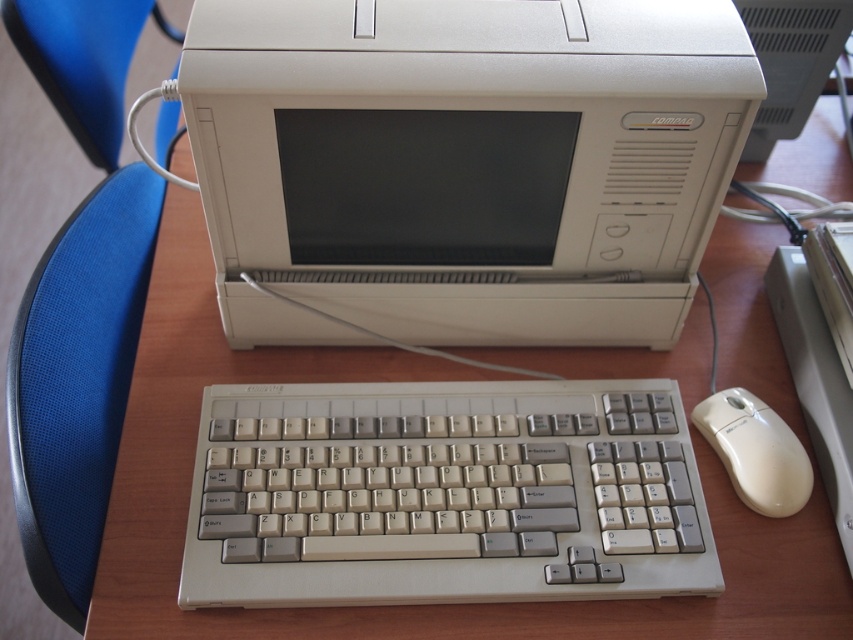
Question: Considering the real-world distances, which object is closest to the beige plastic monitor at center?

Choices:
 (A) beige plastic monitor at upper center
 (B) white plastic mouse at lower right

Answer: (B)

Question: Can you confirm if beige plastic monitor at center is thinner than white plastic mouse at lower right?

Choices:
 (A) yes
 (B) no

Answer: (B)

Question: Does blue fabric chair at left have a smaller size compared to beige plastic monitor at upper center?

Choices:
 (A) yes
 (B) no

Answer: (B)

Question: Observing the image, what is the correct spatial positioning of blue fabric chair at left in reference to white plastic mouse at lower right?

Choices:
 (A) below
 (B) above

Answer: (B)

Question: Considering the real-world distances, which object is closest to the white plastic mouse at lower right?

Choices:
 (A) blue fabric chair at left
 (B) beige plastic monitor at center

Answer: (B)

Question: Which object is positioned farthest from the white plastic mouse at lower right?

Choices:
 (A) beige plastic monitor at center
 (B) beige plastic keyboard at center

Answer: (A)